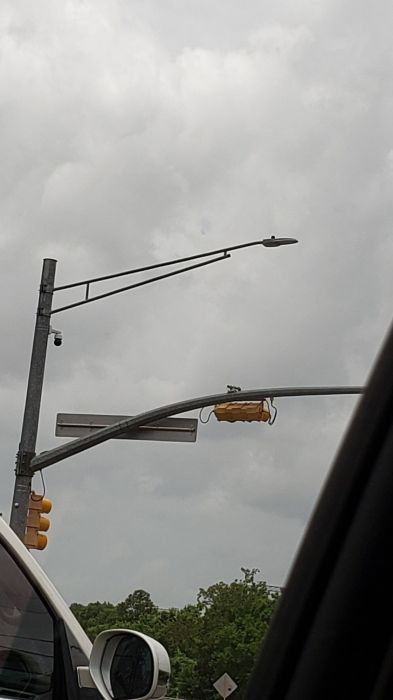
Identify the location of lights. This screenshot has width=393, height=700. (280, 237), (57, 336).